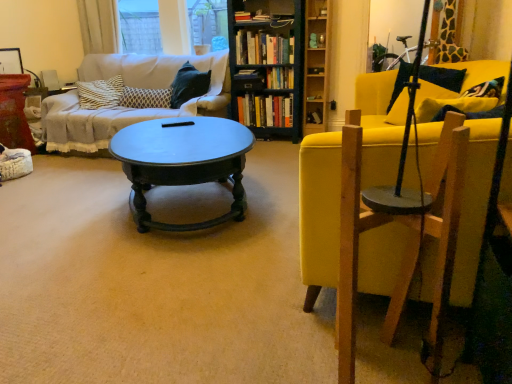
Find the location of `free point behind wooden swivel chair at right`. free point behind wooden swivel chair at right is located at coordinates (357, 313).